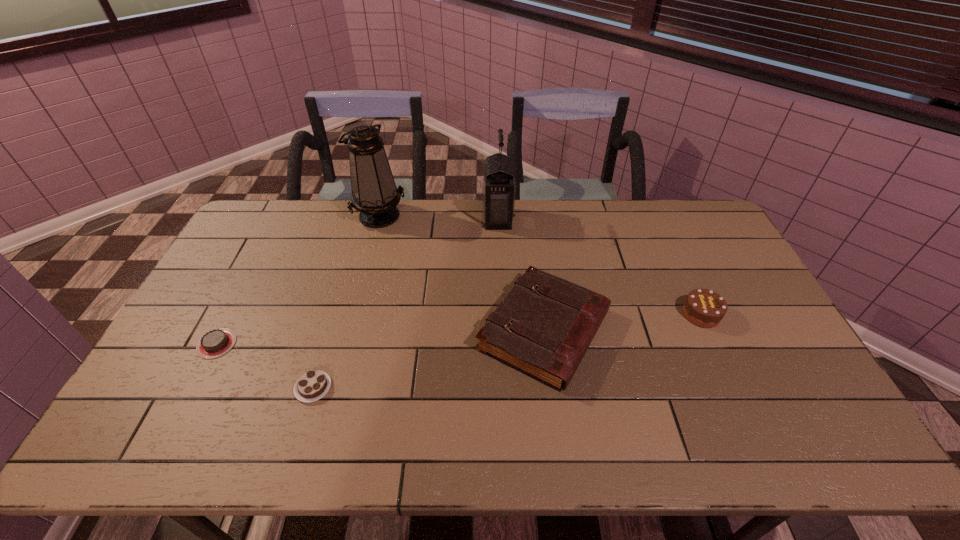
The width and height of the screenshot is (960, 540). Find the location of `free region located 0.140m on the front-facing side of the lantern`. free region located 0.140m on the front-facing side of the lantern is located at coordinates (444, 219).

Identify the location of vacant space located 0.150m on the front-facing side of the lantern. The image size is (960, 540). (443, 219).

Locate an element on the screen. This screenshot has width=960, height=540. free region located 0.350m on the left of the tallest chocolate cake is located at coordinates pyautogui.click(x=564, y=314).

This screenshot has height=540, width=960. Identify the location of free space located on the back of the hardback book. (536, 269).

Identify the location of vacant space located on the left of the second chocolate cake from left to right. (148, 388).

Find the location of a particular element. Image resolution: width=960 pixels, height=540 pixels. blank space located on the back of the leftmost object is located at coordinates click(x=270, y=241).

This screenshot has width=960, height=540. I want to click on oil lamp present at the far edge, so click(x=374, y=193).

Image resolution: width=960 pixels, height=540 pixels. I want to click on lantern that is at the far edge, so click(x=499, y=189).

At what (x,y) coordinates should I click in order to perform the action: click on object that is at the left edge. Please return your answer as a coordinate pair (x, y). This screenshot has width=960, height=540. Looking at the image, I should click on (215, 343).

Where is `object that is at the right edge`? This screenshot has width=960, height=540. object that is at the right edge is located at coordinates (704, 308).